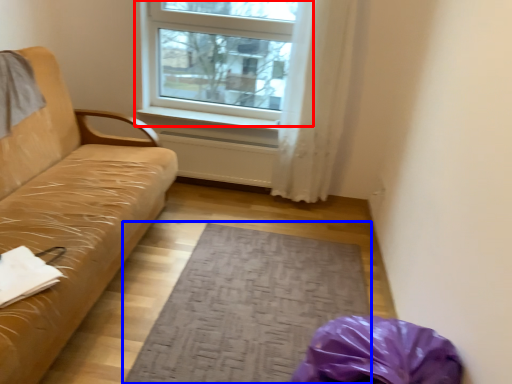
Question: Which point is closer to the camera, window (highlighted by a red box) or mat (highlighted by a blue box)?

Choices:
 (A) window
 (B) mat

Answer: (B)